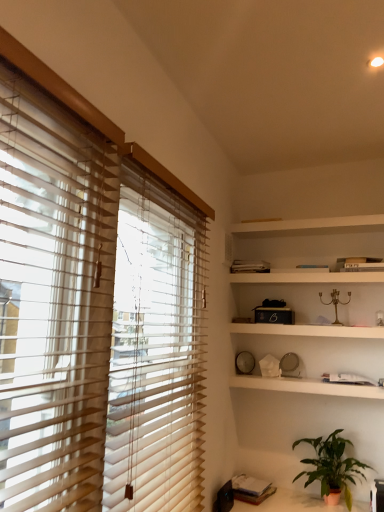
Question: In which direction should I rotate to look at white wooden shelf at upper center, positioned as the 1th shelf in top-to-bottom order?

Choices:
 (A) right
 (B) left

Answer: (A)

Question: Is white wooden shelf at upper center, marked as the fourth shelf in a bottom-to-top arrangement, oriented towards white matte clock at center, which is the 1th shelf from bottom to top?

Choices:
 (A) yes
 (B) no

Answer: (B)

Question: From the image's perspective, would you say white wooden shelf at upper center, marked as the fourth shelf in a bottom-to-top arrangement, is positioned over white matte clock at center, which is the 1th shelf from bottom to top?

Choices:
 (A) yes
 (B) no

Answer: (A)

Question: Can white matte clock at center, which is the 1th shelf from bottom to top, be found inside white wooden shelf at upper center, positioned as the 1th shelf in top-to-bottom order?

Choices:
 (A) yes
 (B) no

Answer: (B)

Question: Can you confirm if white wooden shelf at upper center, positioned as the 1th shelf in top-to-bottom order, is wider than white matte clock at center, the 4th shelf viewed from the top?

Choices:
 (A) no
 (B) yes

Answer: (A)

Question: From a real-world perspective, is white wooden shelf at upper center, marked as the fourth shelf in a bottom-to-top arrangement, below white matte clock at center, the 4th shelf viewed from the top?

Choices:
 (A) no
 (B) yes

Answer: (A)

Question: Is white wooden shelf at upper center, positioned as the 1th shelf in top-to-bottom order, facing away from white matte clock at center, the 4th shelf viewed from the top?

Choices:
 (A) yes
 (B) no

Answer: (B)

Question: Is matte black table at lower right touching green matte plant at lower right?

Choices:
 (A) no
 (B) yes

Answer: (A)

Question: Considering the relative positions of matte black table at lower right and green matte plant at lower right in the image provided, is matte black table at lower right to the right of green matte plant at lower right from the viewer's perspective?

Choices:
 (A) yes
 (B) no

Answer: (B)

Question: Is matte black table at lower right smaller than green matte plant at lower right?

Choices:
 (A) yes
 (B) no

Answer: (B)

Question: From the image's perspective, does matte black table at lower right appear lower than green matte plant at lower right?

Choices:
 (A) yes
 (B) no

Answer: (A)

Question: Is matte black table at lower right turned away from green matte plant at lower right?

Choices:
 (A) no
 (B) yes

Answer: (A)

Question: Can you confirm if matte black table at lower right is taller than green matte plant at lower right?

Choices:
 (A) no
 (B) yes

Answer: (A)

Question: Can you confirm if green matte plant at lower right is taller than white matte bookshelf at upper center, which is counted as the 2th shelf, starting from the top?

Choices:
 (A) no
 (B) yes

Answer: (B)